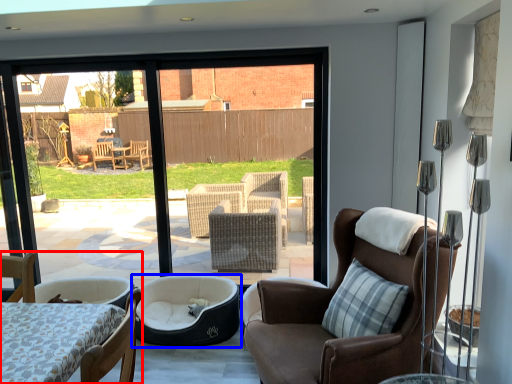
Question: Which object is further to the camera taking this photo, chair (highlighted by a red box) or dog bed (highlighted by a blue box)?

Choices:
 (A) chair
 (B) dog bed

Answer: (B)